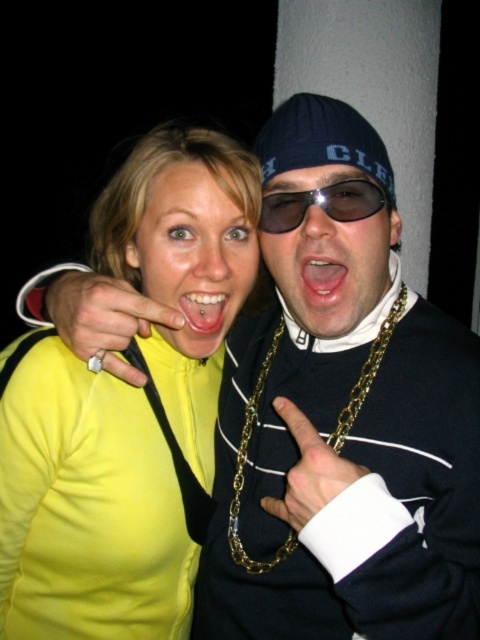
Question: Which of the following is the closest to the observer?

Choices:
 (A) (216, 307)
 (B) (305, 300)

Answer: (B)

Question: Is yellow matte jacket at center smaller than pierced flesh at center?

Choices:
 (A) yes
 (B) no

Answer: (B)

Question: Considering the relative positions of matte black sunglasses at center and sunglasses at center in the image provided, where is matte black sunglasses at center located with respect to sunglasses at center?

Choices:
 (A) right
 (B) left

Answer: (A)

Question: Which of the following is the closest to the observer?

Choices:
 (A) (322, 193)
 (B) (336, 278)
 (C) (207, 266)

Answer: (A)

Question: Which object is positioned farthest from the matte black sunglasses at center?

Choices:
 (A) pink glossy lips at center
 (B) yellow matte jacket at center
 (C) pierced flesh at center

Answer: (B)

Question: Is matte black sunglasses at center positioned in front of pierced flesh at center?

Choices:
 (A) yes
 (B) no

Answer: (A)